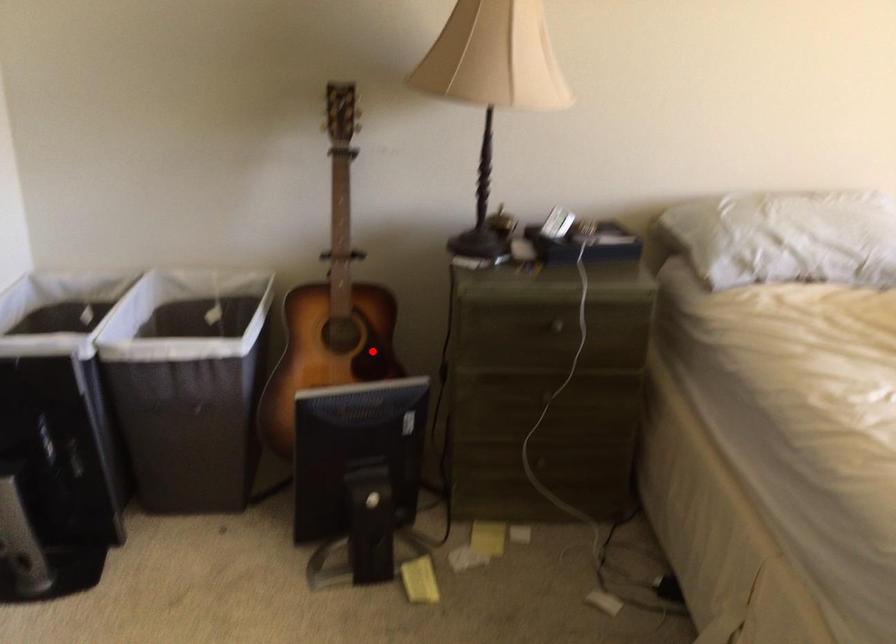
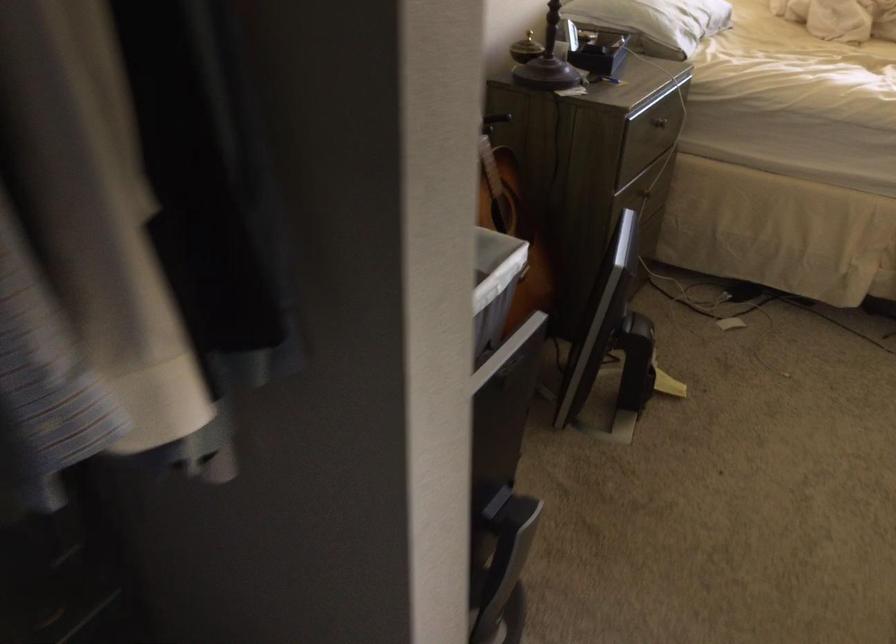
In the second image, find the point that corresponds to the highlighted location in the first image.

(513, 227)